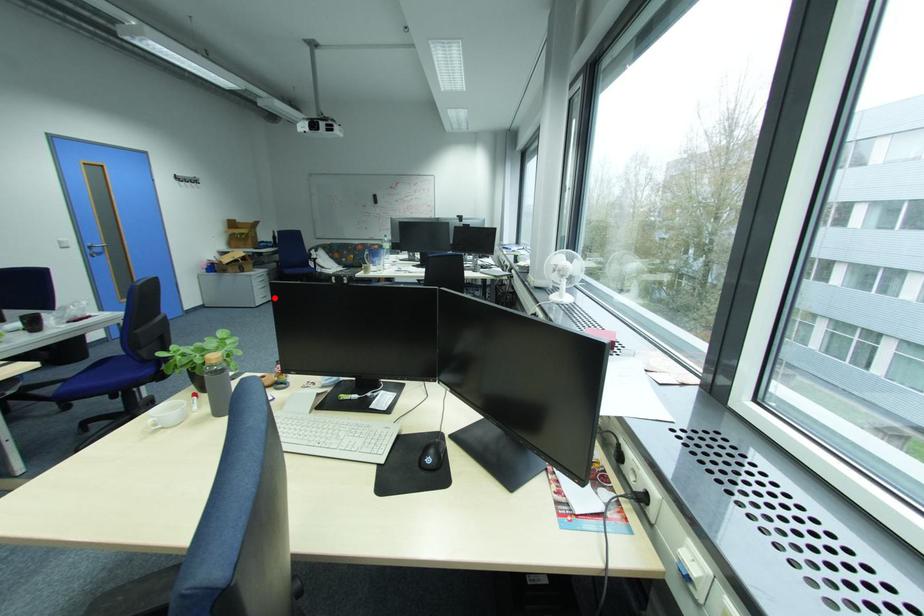
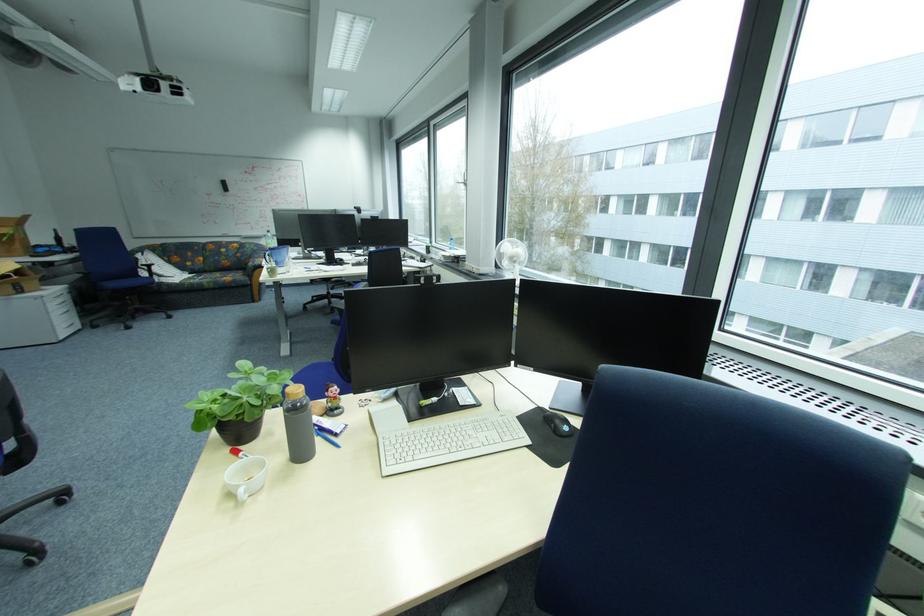
Question: A red point is marked in image1. In image2, is the corresponding 3D point closer to the camera or farther? Reply with the corresponding letter.

Choices:
 (A) The corresponding 3D point is closer.
 (B) The corresponding 3D point is farther.

Answer: (B)